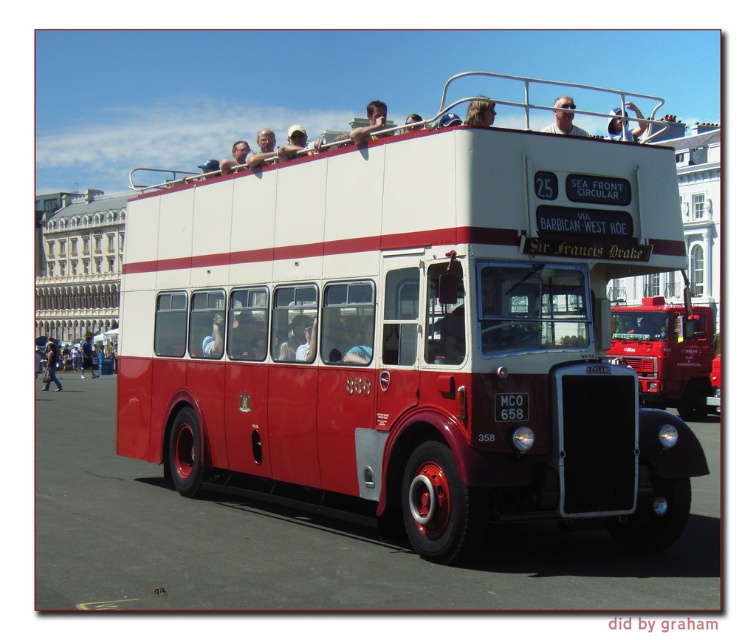
You are standing in front of the vintage double decker bus. There are two points marked on the bus, one at point [637,364] and the other at point [621,115]. Which point is closer to you?

Point [637,364] is further to the viewer than point [621,115], so the point closer to you is point [621,115].

You are a photographer taking a picture of the vintage double decker bus. You notice two items on the upper deck at the center area. Which item is positioned to the right when viewed from the front of the bus? The items are matte black sunglasses at upper center and white fabric cap at upper center.

The matte black sunglasses at upper center is positioned to the right of the white fabric cap at upper center when viewed from the front of the bus.

You are driving a car that is 4 meters long. You need to park your car between the red metallic truck at center and the matte skin at upper center. Is there enough space for your car to fit between them?

The distance between the red metallic truck at center and the matte skin at upper center is 16.94 meters. Since your car is only 4 meters long, there is sufficient space to park between them.